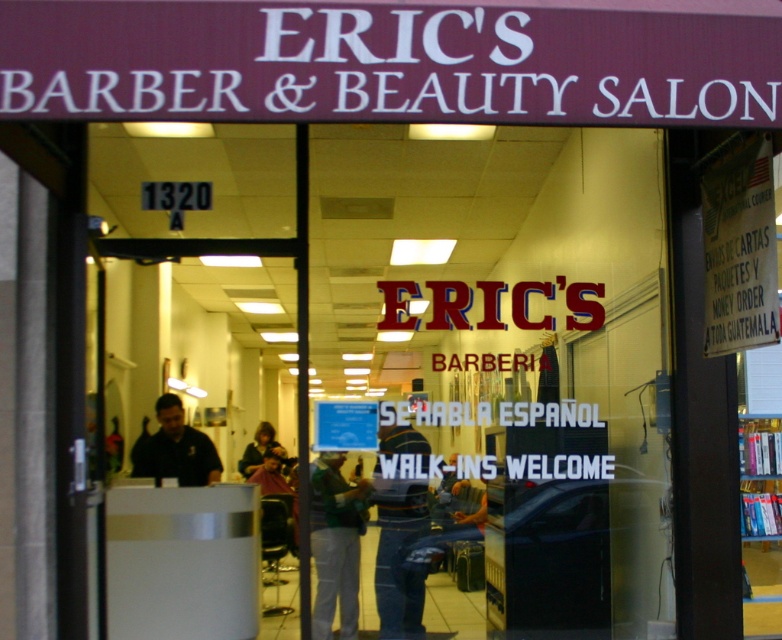
Question: Which object is farther from the camera taking this photo?

Choices:
 (A) dark blue shirt at center
 (B) dark brown hair at center
 (C) blue jeans at center
 (D) green fabric shirt at center

Answer: (B)

Question: Can you confirm if blue jeans at center is positioned to the right of dark blue shirt at center?

Choices:
 (A) yes
 (B) no

Answer: (A)

Question: Can you confirm if green fabric shirt at center is positioned to the left of dark brown hair at center?

Choices:
 (A) no
 (B) yes

Answer: (A)

Question: Which point is closer to the camera taking this photo?

Choices:
 (A) (352, 570)
 (B) (262, 449)

Answer: (A)

Question: Among these points, which one is nearest to the camera?

Choices:
 (A) 336,577
 (B) 192,433
 (C) 395,550
 (D) 268,444

Answer: (A)

Question: Is blue jeans at center thinner than dark blue shirt at center?

Choices:
 (A) yes
 (B) no

Answer: (A)